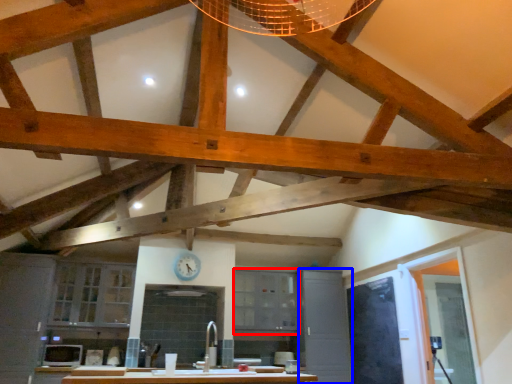
Question: Which object appears closest to the camera in this image, cabinetry (highlighted by a red box) or cabinetry (highlighted by a blue box)?

Choices:
 (A) cabinetry
 (B) cabinetry

Answer: (B)